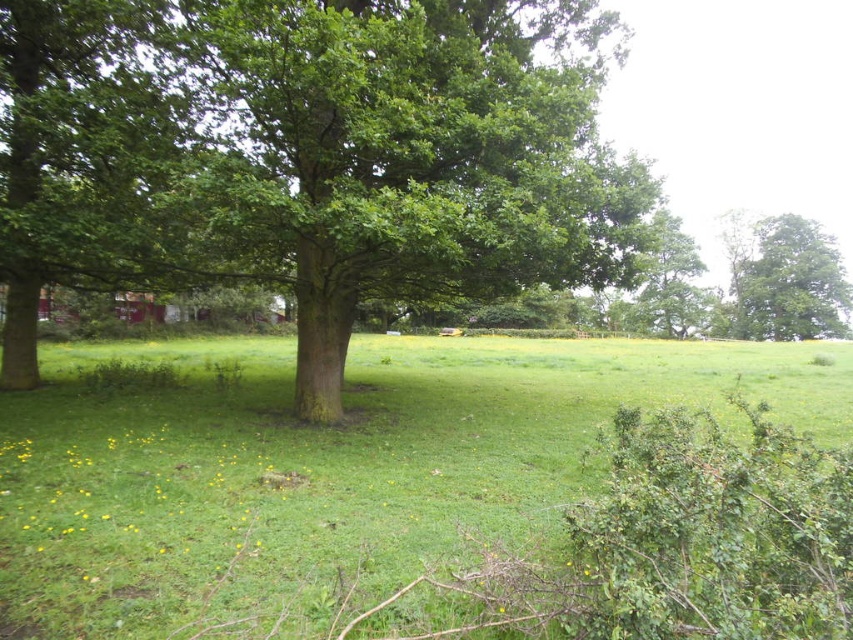
Who is more forward, (360, 385) or (793, 292)?

Point (360, 385) is in front.

Does point (496, 438) come in front of point (780, 257)?

Yes, it is in front of point (780, 257).

Locate an element on the screen. This screenshot has height=640, width=853. green grass at center is located at coordinates (331, 467).

Which is above, green smooth tree at center or green leafy tree at upper right?

green leafy tree at upper right is above.

Based on the photo, measure the distance between green smooth tree at center and green leafy tree at upper right.

green smooth tree at center and green leafy tree at upper right are 81.18 meters apart.

This screenshot has height=640, width=853. I want to click on green smooth tree at center, so [311, 156].

You are a GUI agent. You are given a task and a screenshot of the screen. Output one action in this format:
    pyautogui.click(x=<x>, y=<y>)
    Task: Click on the green smooth tree at center
    This screenshot has width=853, height=640.
    Given the screenshot: What is the action you would take?
    pyautogui.click(x=311, y=156)

Is green smooth tree at center behind green grass at center?

Yes.

How much distance is there between green smooth tree at center and green grass at center?

green smooth tree at center is 4.76 meters away from green grass at center.

Is point (460, 246) positioned after point (723, 406)?

No, (460, 246) is closer to viewer.

I want to click on green smooth tree at center, so click(311, 156).